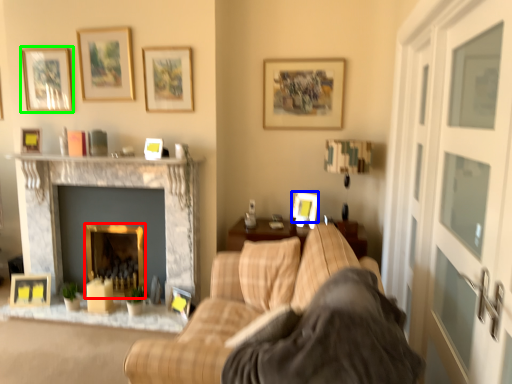
Question: Which object is positioned farthest from fireplace (highlighted by a red box)? Select from picture frame (highlighted by a blue box) and picture frame (highlighted by a green box).

Choices:
 (A) picture frame
 (B) picture frame

Answer: (A)